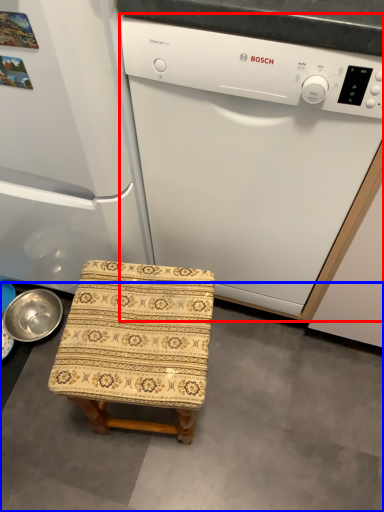
Question: Which object appears farthest to the camera in this image, home appliance (highlighted by a red box) or concrete (highlighted by a blue box)?

Choices:
 (A) home appliance
 (B) concrete

Answer: (B)